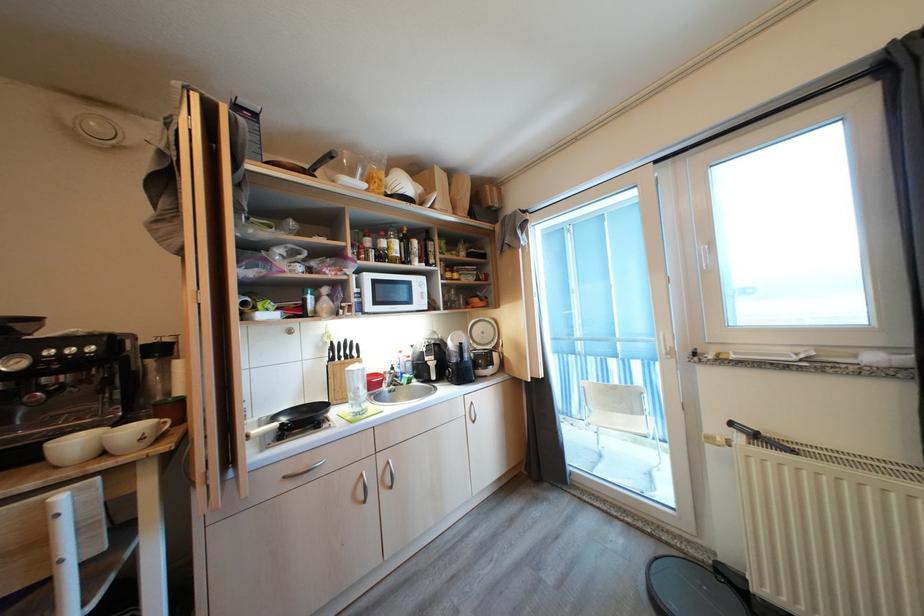
This screenshot has width=924, height=616. Identify the location of silver cabinet knob. (360, 488).